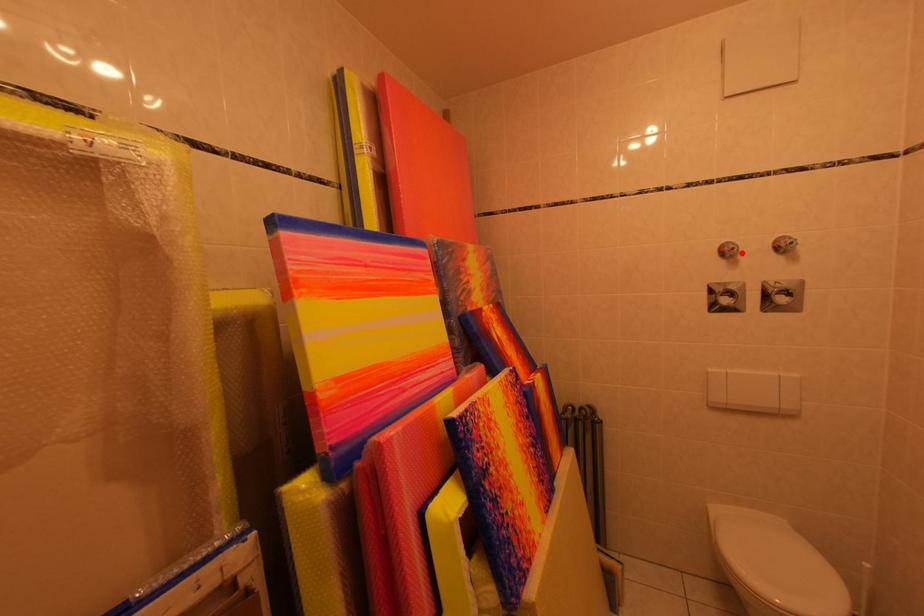
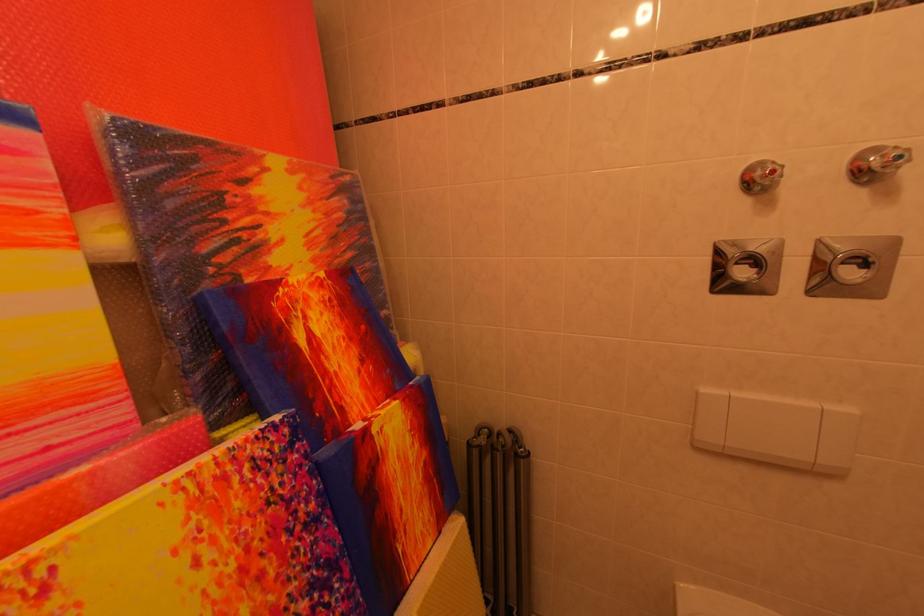
Question: I am providing you with two images of the same scene from different viewpoints. A red point is marked on the first image. Is the red point's position out of view in image 2?

Choices:
 (A) Yes
 (B) No

Answer: (B)